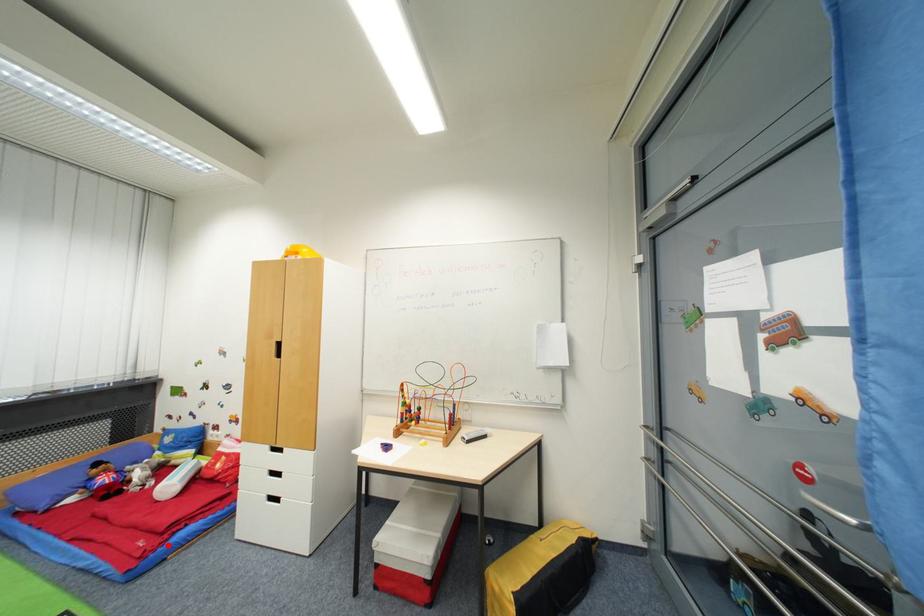
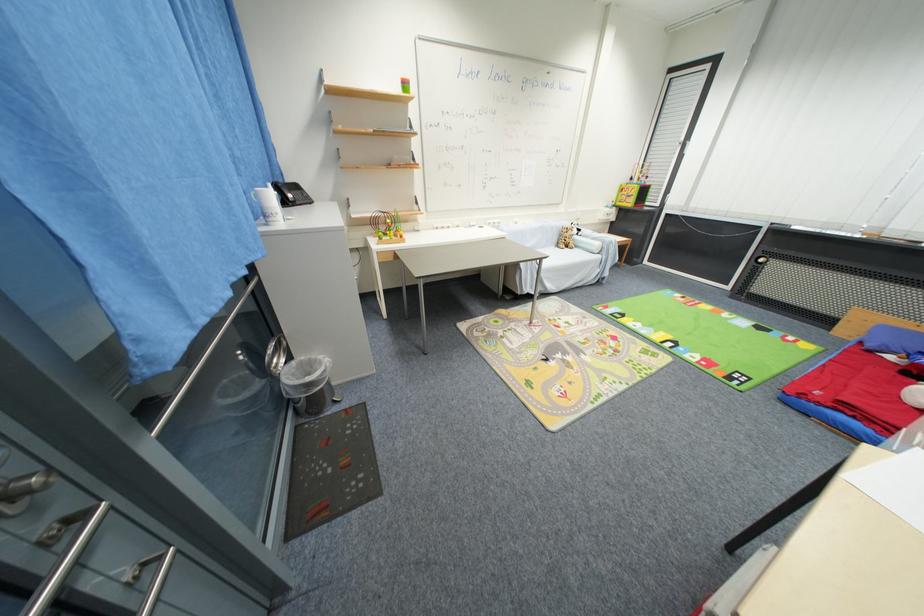
Question: I am providing you with two images of the same scene from different viewpoints. A red point is shown in image1. For the corresponding object point in image2, is it positioned nearer or farther from the camera?

Choices:
 (A) Nearer
 (B) Farther

Answer: (B)